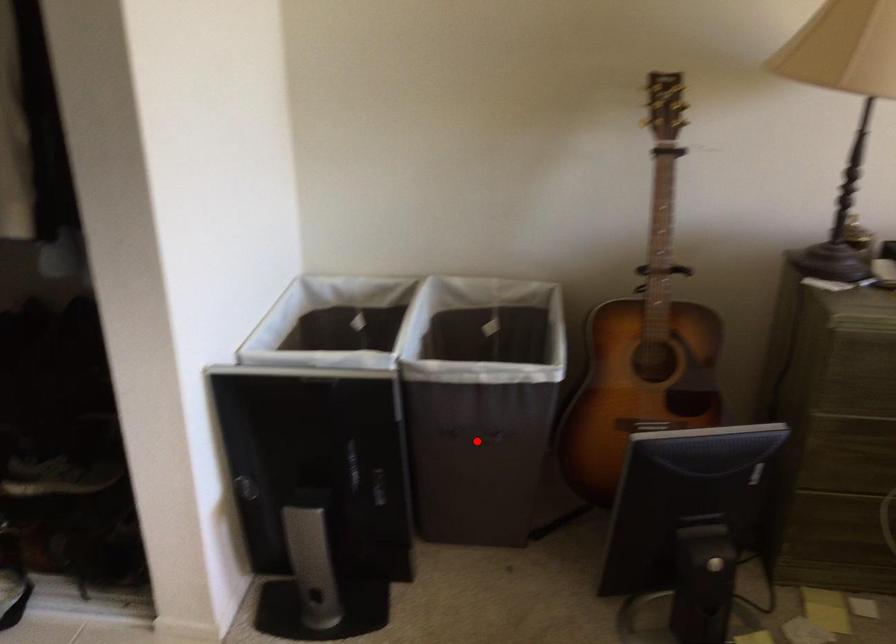
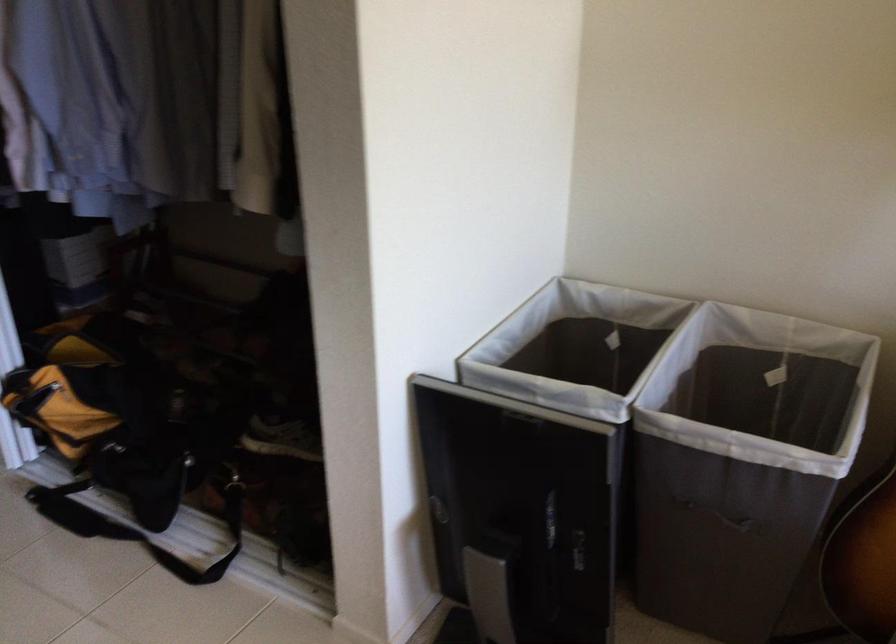
The point at the highlighted location is marked in the first image. Where is the corresponding point in the second image?

(719, 516)